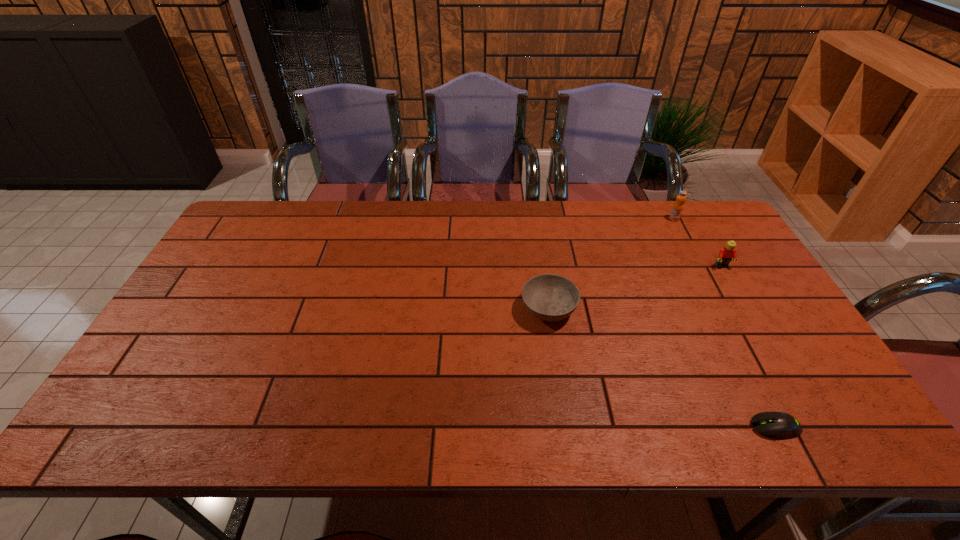
The width and height of the screenshot is (960, 540). In order to click on blank area located 0.370m on the wheel side of the computer mouse in this screenshot , I will do point(583,427).

Where is `blank space located on the wheel side of the computer mouse`? blank space located on the wheel side of the computer mouse is located at coordinates (596, 427).

The width and height of the screenshot is (960, 540). I want to click on free region located on the wheel side of the computer mouse, so click(709, 427).

Where is `object that is at the far edge`? Image resolution: width=960 pixels, height=540 pixels. object that is at the far edge is located at coordinates (678, 206).

Find the location of a particular element. This screenshot has width=960, height=540. object at the near edge is located at coordinates (779, 425).

Identify the location of orange juice present at the right edge. The width and height of the screenshot is (960, 540). (678, 206).

Find the location of a particular element. The image size is (960, 540). Lego positioned at the right edge is located at coordinates (726, 254).

Find the location of `computer mouse located in the right edge section of the desktop`. computer mouse located in the right edge section of the desktop is located at coordinates (779, 425).

This screenshot has width=960, height=540. I want to click on object situated at the far right corner, so click(x=678, y=206).

What are the coordinates of `object that is at the near right corner` in the screenshot? It's located at (779, 425).